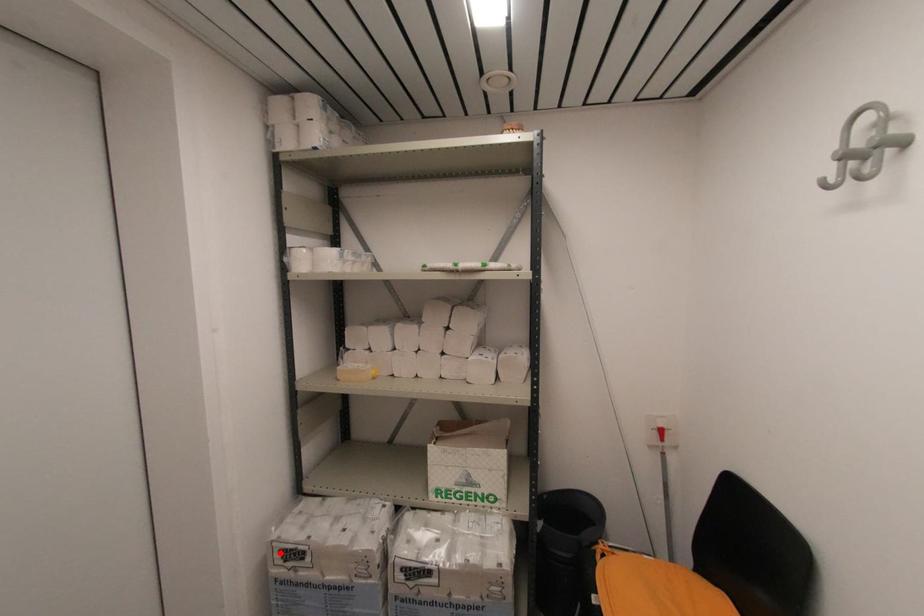
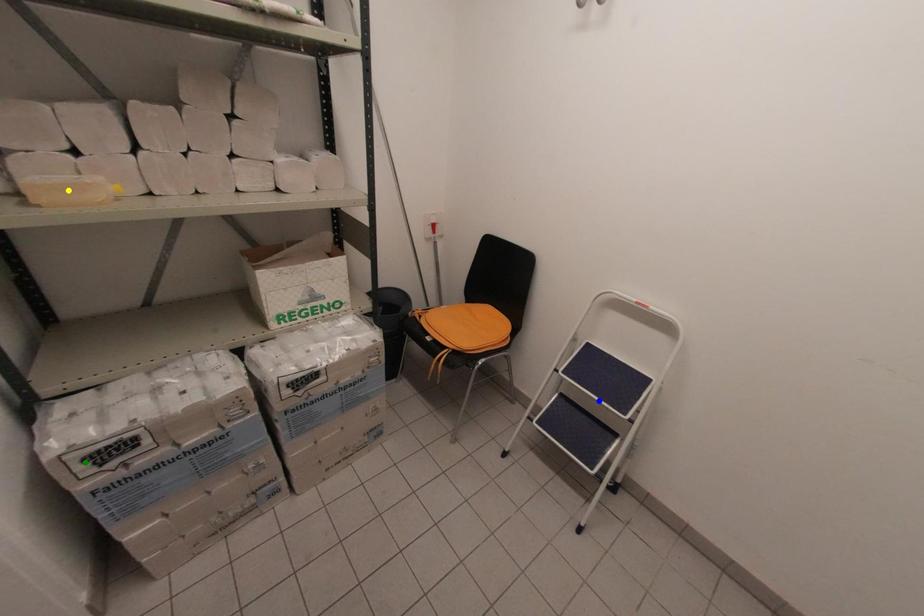
Question: I am providing you with two images of the same scene from different viewpoints. A red point is marked on the first image. You are given multiple points on the second image. Which spot in image 2 lines up with the point in image 1?

Choices:
 (A) blue point
 (B) yellow point
 (C) green point

Answer: (C)